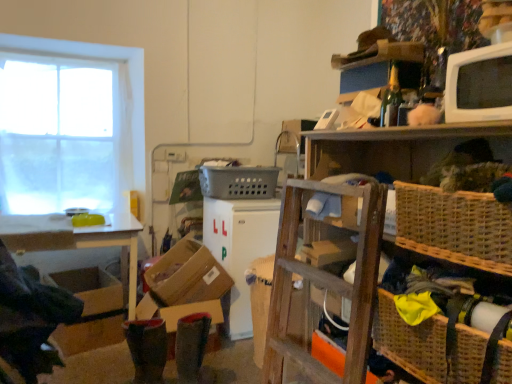
Question: In terms of height, does white glossy microwave at upper right, which is counted as the first appliance, starting from the front, look taller or shorter compared to brown cardboard box at lower left?

Choices:
 (A) short
 (B) tall

Answer: (A)

Question: Does point (499, 64) appear closer or farther from the camera than point (117, 309)?

Choices:
 (A) farther
 (B) closer

Answer: (B)

Question: Which object is positioned closest to the brown cardboard box at lower center?

Choices:
 (A) white sheer curtain at left
 (B) brown cardboard box at lower left
 (C) woven brown basket at lower right, the 3th basket in the top-to-bottom sequence
 (D) white plastic refrigerator at center, which ranks as the second appliance in right-to-left order
 (E) woven brown basket at right, the second basket viewed from the front

Answer: (D)

Question: Which object is the closest to the brown cardboard box at lower center?

Choices:
 (A) white plastic refrigerator at center, acting as the first appliance starting from the bottom
 (B) brown cardboard box at lower left
 (C) woven wicker basket at upper right
 (D) white glossy microwave at upper right, which is counted as the first appliance, starting from the front
 (E) white glossy table at left

Answer: (A)